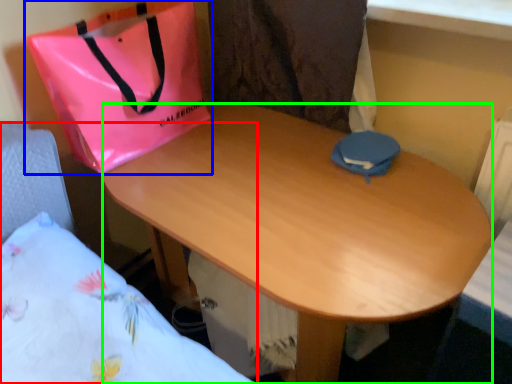
Question: Estimate the real-world distances between objects in this image. Which object is farther from bed (highlighted by a red box), handbag (highlighted by a blue box) or desk (highlighted by a green box)?

Choices:
 (A) handbag
 (B) desk

Answer: (B)